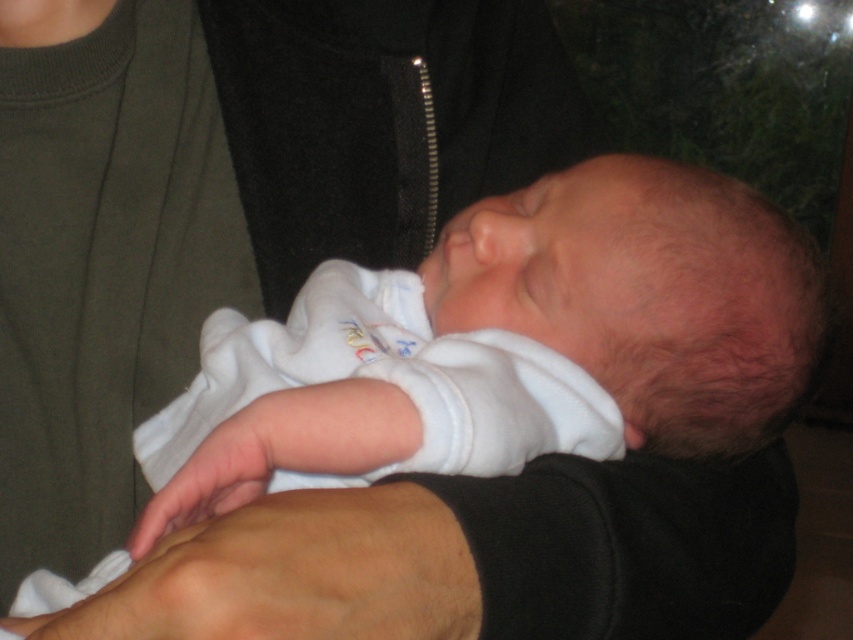
You are a robotic nurse assisting in a hospital nursery. You need to gently place the newborn baby on a changing table. The safety guidelines state that the distance between the baby and any object must be at least 3 inches to prevent accidental contact. Given the current position of the white soft fabric at center and the smooth skin hand at lower center, can you safely move the baby without violating the guidelines?

The distance between the white soft fabric at center and the smooth skin hand at lower center is 2.90 inches, which is less than the required 3 inches. Therefore, moving the baby in this configuration would violate the safety guidelines. Adjust the position to ensure at least 3 inches of separation before proceeding.

You are a photographer trying to capture a closeup of the white soft fabric newborn at center. The camera requires the subject to be at least 45 centimeters away to avoid distortion. Based on the scene, will the newborn be in focus without distortion?

The distance between the white soft fabric newborn at center and the camera is 43.32 centimeters, which is less than the required 45 centimeters. Therefore, the newborn may appear distorted in the photo.

You are a photographer standing 12 inches away from the white soft fabric at center in the image. Can you reach it without moving your position?

The white soft fabric at center is 13.58 inches away from the viewer. Since you are already 12 inches away, you would need to extend your arm or lean forward approximately 1.58 inches to reach it.